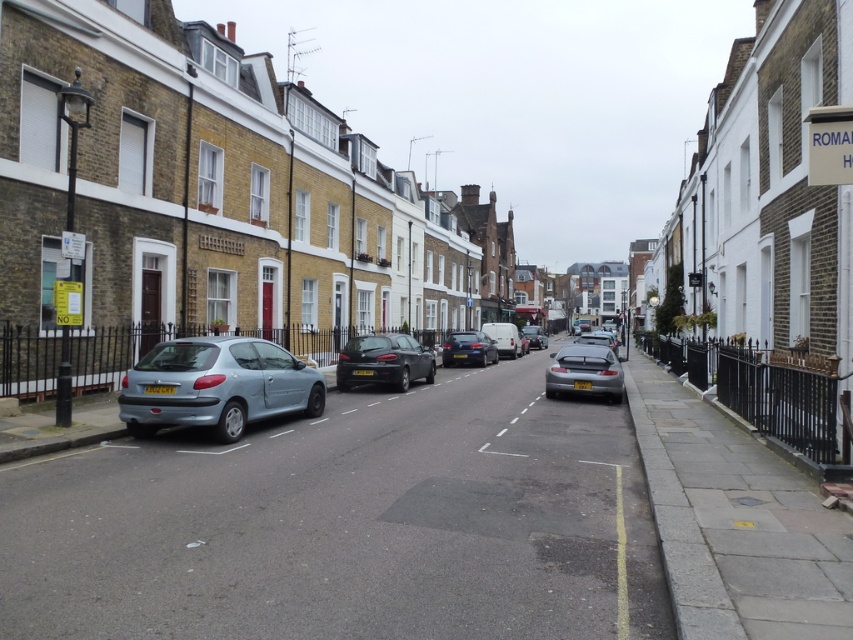
You are standing on the sidewalk and looking down the street. You see a shiny black car at center and a satin silver car at center. Which car is closer to the ground?

The shiny black car at center is located below the satin silver car at center, so it is closer to the ground.

You are a delivery person needing to park your vehicle in the parking space between the glossy metallic car at center and the matte silver car at center. The parking space is 5 meters long. Can your 3.5 meter long delivery van fit in the space without overlapping either car?

The glossy metallic car at center occupies less space than matte silver car at center. Since the parking space is 5 meters long and the delivery van is 3.5 meters long, there is enough space for the van to fit without overlapping either car as long as it is positioned appropriately between them.

You are standing at the point with coordinates (468, 348) on the street. What object is located exactly at your current position?

The glossy metallic car at center is located exactly at the point with coordinates (468, 348).